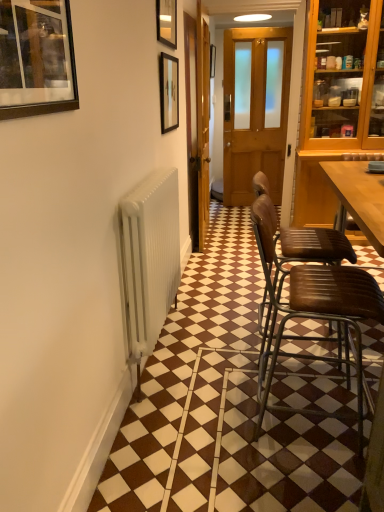
Question: Should I look upward or downward to see wooden door at center?

Choices:
 (A) up
 (B) down

Answer: (A)

Question: Does wooden picture frame at center, which ranks as the fourth picture frame in bottom-to-top order, appear on the right side of brown leather chair at right, which is the first chair in back-to-front order?

Choices:
 (A) yes
 (B) no

Answer: (B)

Question: Is wooden picture frame at center, which ranks as the first picture frame in right-to-left order, positioned beyond the bounds of brown leather chair at right, the 2th chair viewed from the front?

Choices:
 (A) yes
 (B) no

Answer: (A)

Question: Would you consider wooden picture frame at center, marked as the fourth picture frame in a left-to-right arrangement, to be distant from brown leather chair at right, the 2th chair viewed from the front?

Choices:
 (A) yes
 (B) no

Answer: (A)

Question: Is wooden picture frame at center, marked as the fourth picture frame in a left-to-right arrangement, closer to the viewer compared to brown leather chair at right, the 2th chair viewed from the front?

Choices:
 (A) yes
 (B) no

Answer: (B)

Question: Is wooden picture frame at center, which appears as the first picture frame when viewed from the top, facing away from brown leather chair at right, which is the first chair in back-to-front order?

Choices:
 (A) no
 (B) yes

Answer: (A)

Question: Is wooden picture frame at center, positioned as the first picture frame in back-to-front order, bigger than brown leather chair at right, which is the first chair in back-to-front order?

Choices:
 (A) yes
 (B) no

Answer: (B)

Question: Does wooden picture frame at center, which appears as the first picture frame when viewed from the top, touch matte black picture frame at upper left, the fourth picture frame in the back-to-front sequence?

Choices:
 (A) yes
 (B) no

Answer: (B)

Question: Does wooden picture frame at center, acting as the 4th picture frame starting from the front, appear on the left side of matte black picture frame at upper left, the fourth picture frame when ordered from top to bottom?

Choices:
 (A) yes
 (B) no

Answer: (B)

Question: Does wooden picture frame at center, which ranks as the fourth picture frame in bottom-to-top order, have a lesser height compared to matte black picture frame at upper left, the fourth picture frame when ordered from top to bottom?

Choices:
 (A) no
 (B) yes

Answer: (A)

Question: Does wooden picture frame at center, positioned as the first picture frame in back-to-front order, have a greater height compared to matte black picture frame at upper left, the fourth picture frame in the back-to-front sequence?

Choices:
 (A) no
 (B) yes

Answer: (B)

Question: From the image's perspective, is wooden picture frame at center, which appears as the first picture frame when viewed from the top, beneath matte black picture frame at upper left, placed as the 1th picture frame when sorted from front to back?

Choices:
 (A) no
 (B) yes

Answer: (A)

Question: Is wooden picture frame at center, which ranks as the fourth picture frame in bottom-to-top order, oriented towards matte black picture frame at upper left, positioned as the first picture frame in left-to-right order?

Choices:
 (A) yes
 (B) no

Answer: (B)

Question: From the image's perspective, would you say matte black picture frame at upper center, the second picture frame viewed from the right, is shown under wooden picture frame at center, which appears as the first picture frame when viewed from the top?

Choices:
 (A) no
 (B) yes

Answer: (B)